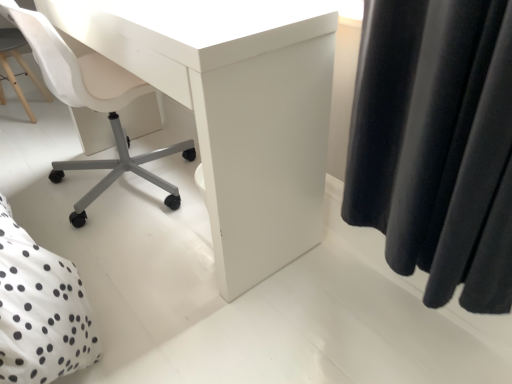
Question: In terms of height, does white dotted fabric at lower left look taller or shorter compared to white matte desk at center?

Choices:
 (A) short
 (B) tall

Answer: (B)

Question: Considering the positions of point (2, 349) and point (287, 198), is point (2, 349) closer or farther from the camera than point (287, 198)?

Choices:
 (A) closer
 (B) farther

Answer: (A)

Question: Estimate the real-world distances between objects in this image. Which object is closer to the white dotted fabric at lower left?

Choices:
 (A) white matte desk at center
 (B) white plastic chair at lower left

Answer: (A)

Question: Estimate the real-world distances between objects in this image. Which object is farther from the white matte desk at center?

Choices:
 (A) white plastic chair at lower left
 (B) white dotted fabric at lower left

Answer: (B)